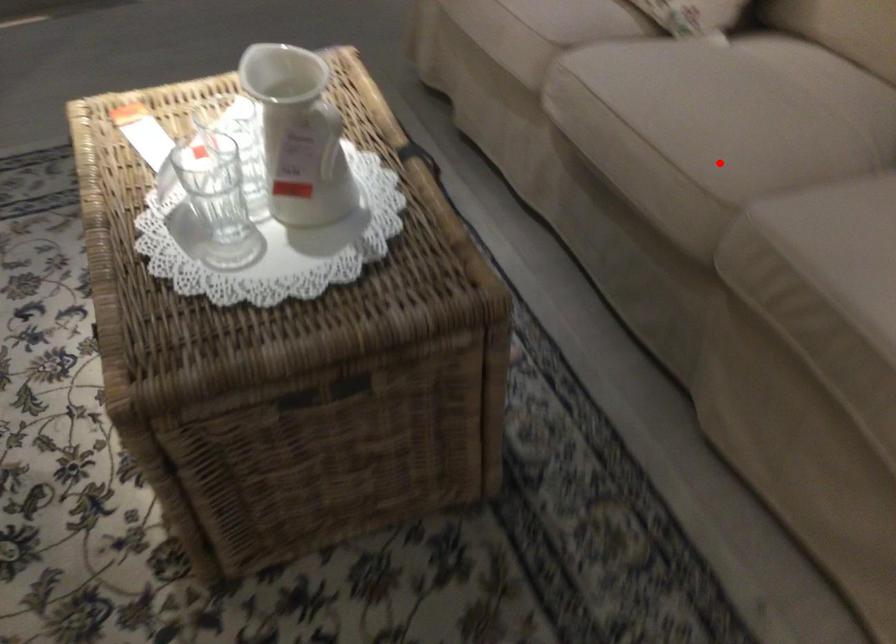
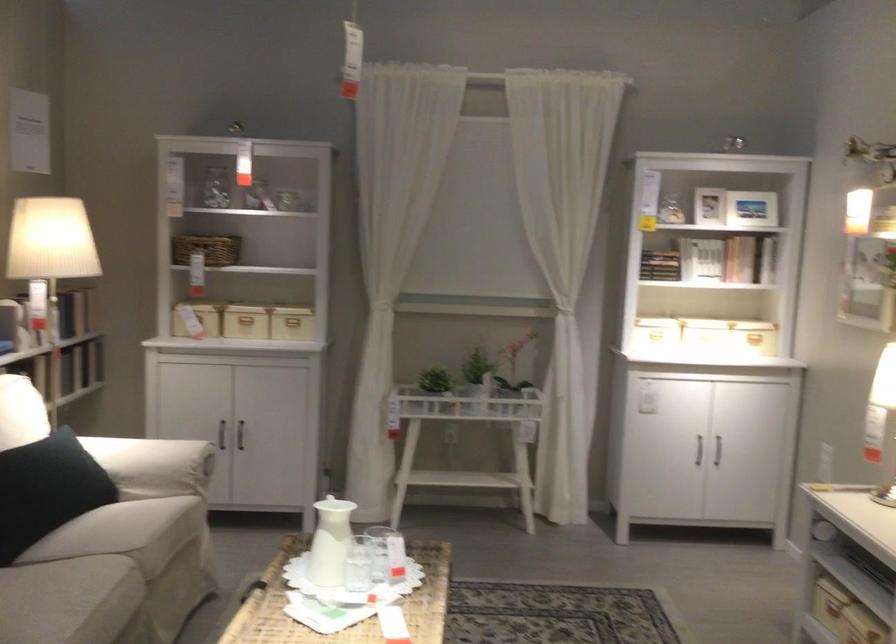
Question: I am providing you with two images of the same scene from different viewpoints. In image1, a red point is highlighted. Considering the same 3D point in image2, which of the following is correct?

Choices:
 (A) It is closer
 (B) It is farther

Answer: (B)